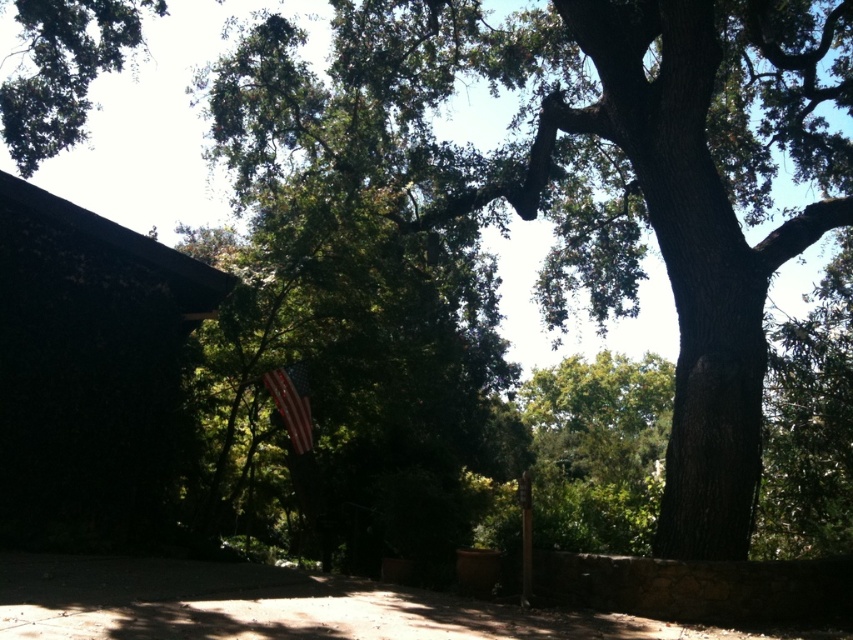
Is point (408, 45) closer to viewer compared to point (288, 426)?

No.

Does smooth bark oak tree at center lie behind american flag at center?

No, it is not.

Between point (720, 401) and point (285, 406), which one is positioned in front?

Point (720, 401) is more forward.

Where is `smooth bark oak tree at center`? smooth bark oak tree at center is located at coordinates (590, 172).

Can you confirm if green leafy tree at upper left is positioned to the right of american flag at center?

Incorrect, green leafy tree at upper left is not on the right side of american flag at center.

Does green leafy tree at upper left have a smaller size compared to american flag at center?

Incorrect, green leafy tree at upper left is not smaller in size than american flag at center.

Identify the location of green leafy tree at upper left. Image resolution: width=853 pixels, height=640 pixels. (62, 70).

Can you confirm if smooth bark oak tree at center is taller than green leafy tree at upper left?

Yes, smooth bark oak tree at center is taller than green leafy tree at upper left.

The width and height of the screenshot is (853, 640). I want to click on smooth bark oak tree at center, so click(590, 172).

Find the location of `smooth bark oak tree at center`. smooth bark oak tree at center is located at coordinates (590, 172).